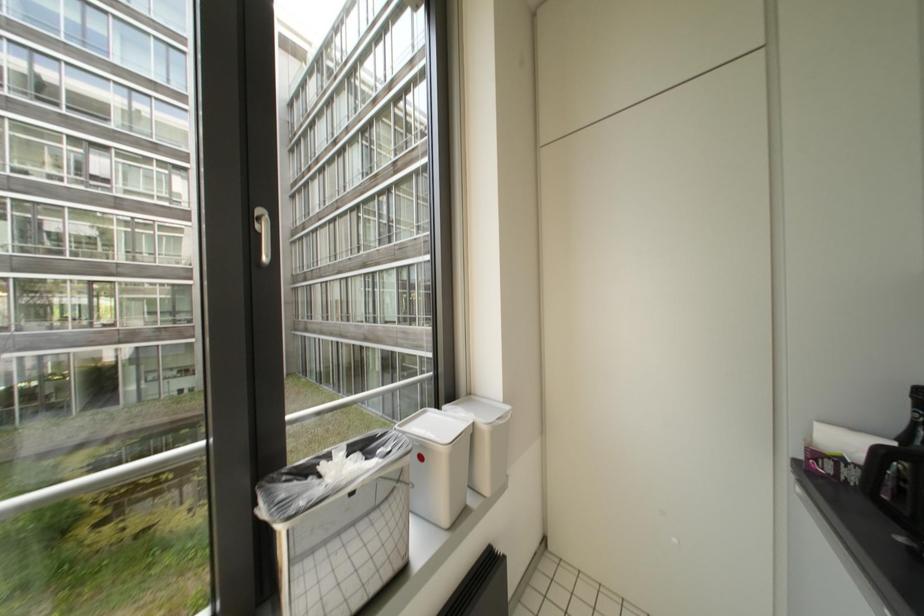
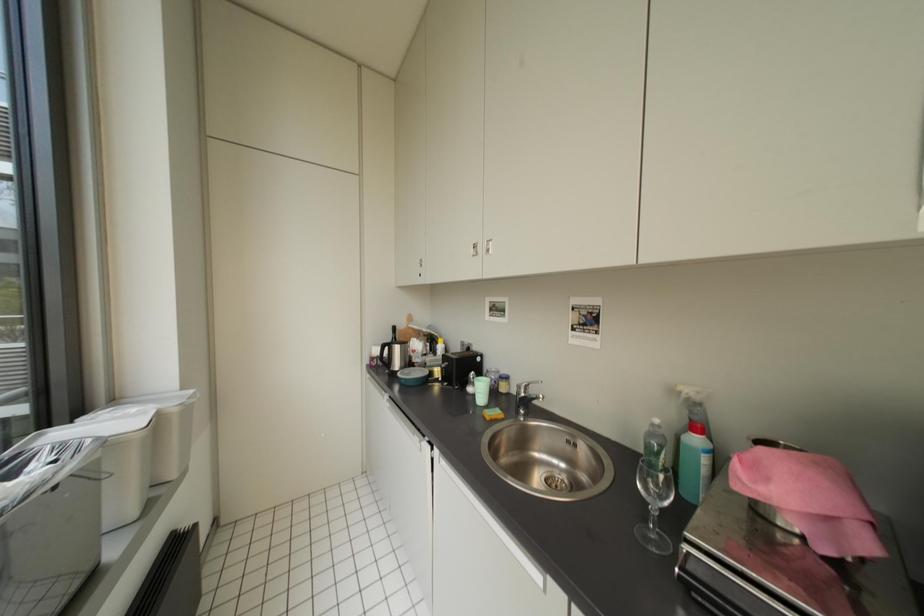
Question: The first image is from the beginning of the video and the second image is from the end. How did the camera likely rotate when shooting the video?

Choices:
 (A) Left
 (B) Right
 (C) Up
 (D) Down

Answer: (B)